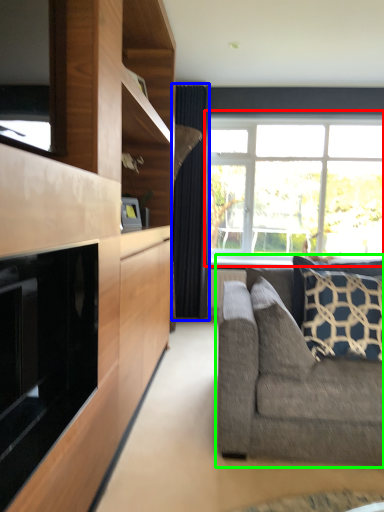
Question: Based on their relative distances, which object is farther from window (highlighted by a red box)? Choose from curtain (highlighted by a blue box) and studio couch (highlighted by a green box).

Choices:
 (A) curtain
 (B) studio couch

Answer: (B)